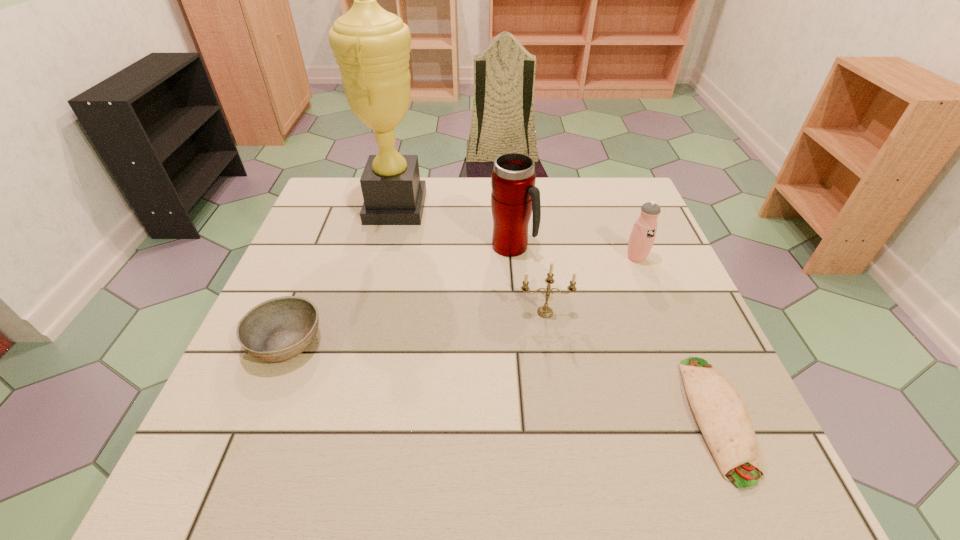
Where is `trophy cup`? This screenshot has width=960, height=540. trophy cup is located at coordinates (371, 45).

I want to click on the left thermos bottle, so click(514, 197).

This screenshot has width=960, height=540. Find the location of `the taller thermos bottle`. the taller thermos bottle is located at coordinates (514, 197).

This screenshot has height=540, width=960. I want to click on the right thermos bottle, so click(x=642, y=236).

The width and height of the screenshot is (960, 540). Identify the location of candle. 544,311.

At what (x,y) coordinates should I click in order to perform the action: click on the second shortest object. Please return your answer as a coordinate pair (x, y). The width and height of the screenshot is (960, 540). Looking at the image, I should click on (278, 329).

Where is `the shortest object`? the shortest object is located at coordinates (721, 414).

Find the location of a particular element. vacant space positioned 0.310m at the front of the trophy cup with handles is located at coordinates (535, 207).

At what (x,y) coordinates should I click in order to perform the action: click on vacant area situated 0.280m on the side with the handle of the left thermos bottle. Please return your answer as a coordinate pair (x, y). Looking at the image, I should click on (643, 247).

Locate an element on the screen. The width and height of the screenshot is (960, 540). vacant space positioned 0.210m on the left of the shorter thermos bottle is located at coordinates coord(541,257).